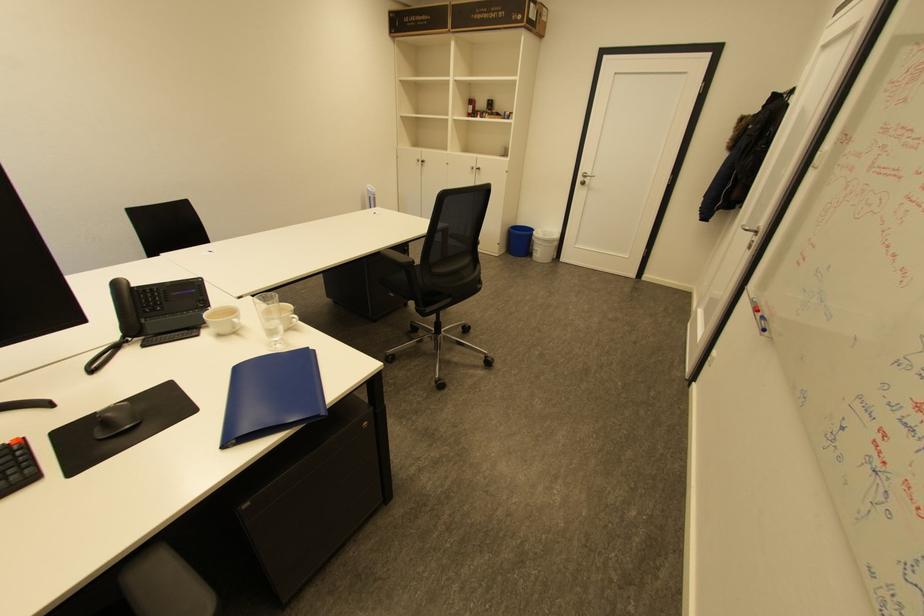
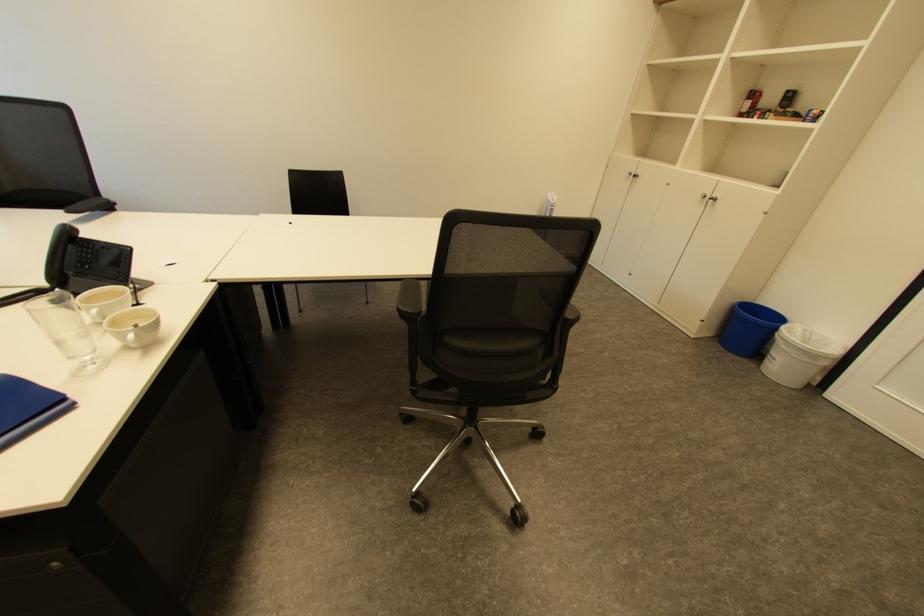
The point at (165, 309) is marked in the first image. Where is the corresponding point in the second image?

(92, 267)